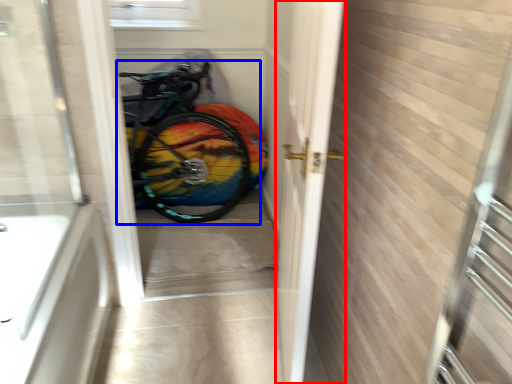
Question: Which object appears farthest to the camera in this image, screen door (highlighted by a red box) or bicycle (highlighted by a blue box)?

Choices:
 (A) screen door
 (B) bicycle

Answer: (B)